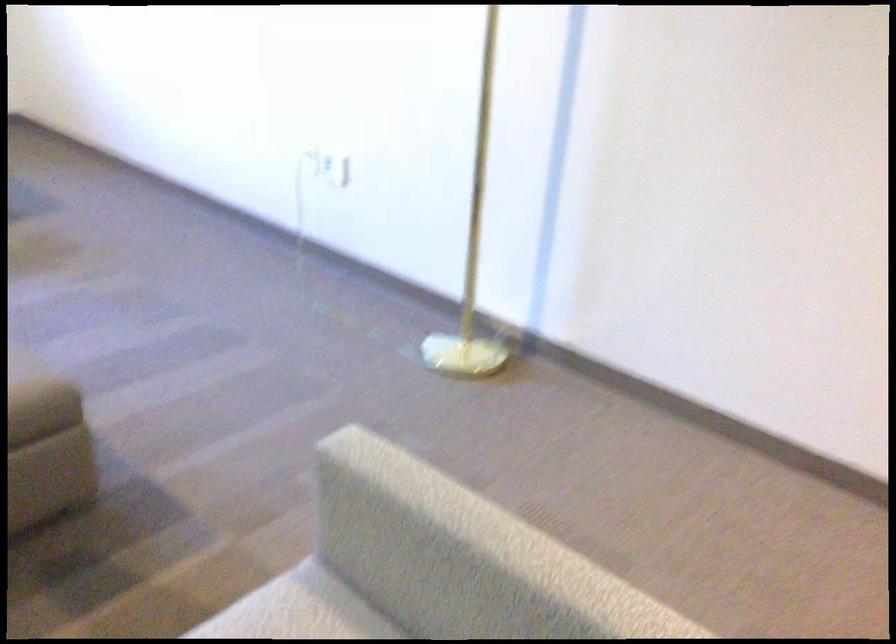
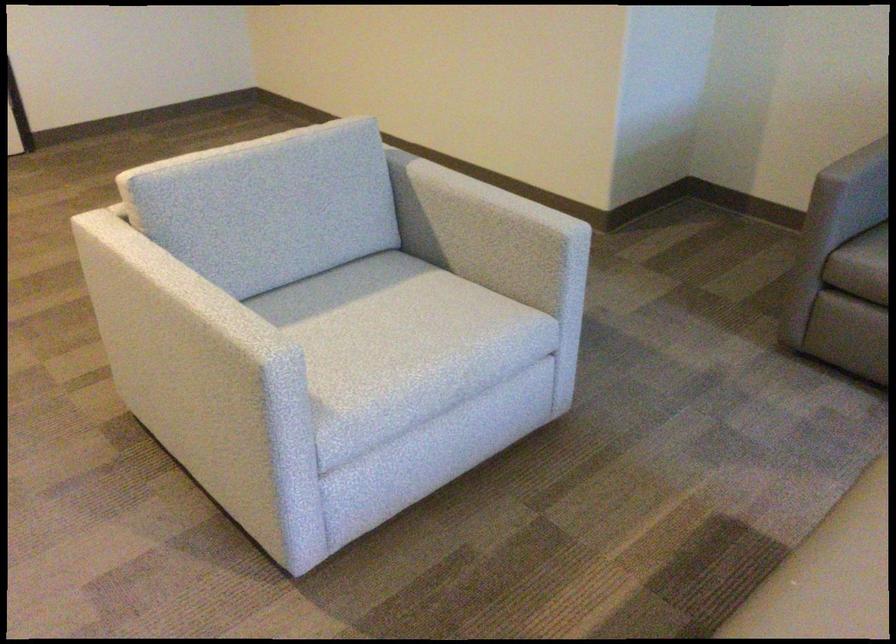
In the second image, find the point that corresponds to [490,538] in the first image.

(195, 294)